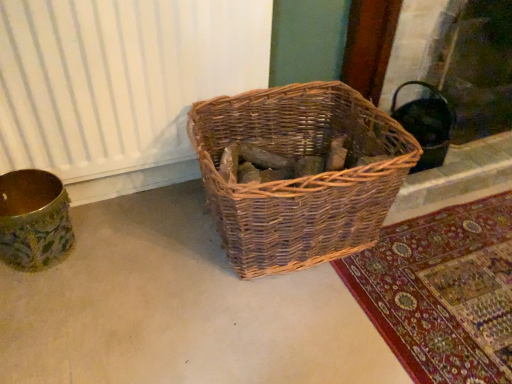
Question: Is black matte fireplace at upper right located outside natural woven basket at center?

Choices:
 (A) yes
 (B) no

Answer: (A)

Question: Are black matte fireplace at upper right and natural woven basket at center making contact?

Choices:
 (A) yes
 (B) no

Answer: (B)

Question: Does black matte fireplace at upper right have a smaller size compared to natural woven basket at center?

Choices:
 (A) yes
 (B) no

Answer: (B)

Question: Considering the relative positions of black matte fireplace at upper right and natural woven basket at center in the image provided, is black matte fireplace at upper right to the right of natural woven basket at center from the viewer's perspective?

Choices:
 (A) no
 (B) yes

Answer: (B)

Question: From the image's perspective, is black matte fireplace at upper right above natural woven basket at center?

Choices:
 (A) yes
 (B) no

Answer: (A)

Question: From a real-world perspective, relative to gold textured vase at left, is black matte fireplace at upper right vertically above or below?

Choices:
 (A) below
 (B) above

Answer: (B)

Question: Does point (430, 74) appear closer or farther from the camera than point (33, 170)?

Choices:
 (A) farther
 (B) closer

Answer: (A)

Question: In terms of width, does black matte fireplace at upper right look wider or thinner when compared to gold textured vase at left?

Choices:
 (A) wide
 (B) thin

Answer: (A)

Question: Considering the positions of black matte fireplace at upper right and gold textured vase at left in the image, is black matte fireplace at upper right bigger or smaller than gold textured vase at left?

Choices:
 (A) small
 (B) big

Answer: (B)

Question: Is point (496, 96) closer or farther from the camera than point (289, 94)?

Choices:
 (A) farther
 (B) closer

Answer: (A)

Question: Looking at their shapes, would you say black matte fireplace at upper right is wider or thinner than natural woven basket at center?

Choices:
 (A) wide
 (B) thin

Answer: (B)

Question: Relative to natural woven basket at center, is black matte fireplace at upper right in front or behind?

Choices:
 (A) front
 (B) behind

Answer: (B)

Question: Considering the positions of black matte fireplace at upper right and natural woven basket at center in the image, is black matte fireplace at upper right bigger or smaller than natural woven basket at center?

Choices:
 (A) big
 (B) small

Answer: (A)

Question: In terms of height, does gold textured vase at left look taller or shorter compared to black matte fireplace at upper right?

Choices:
 (A) short
 (B) tall

Answer: (A)

Question: Would you say gold textured vase at left is to the left or to the right of black matte fireplace at upper right in the picture?

Choices:
 (A) right
 (B) left

Answer: (B)